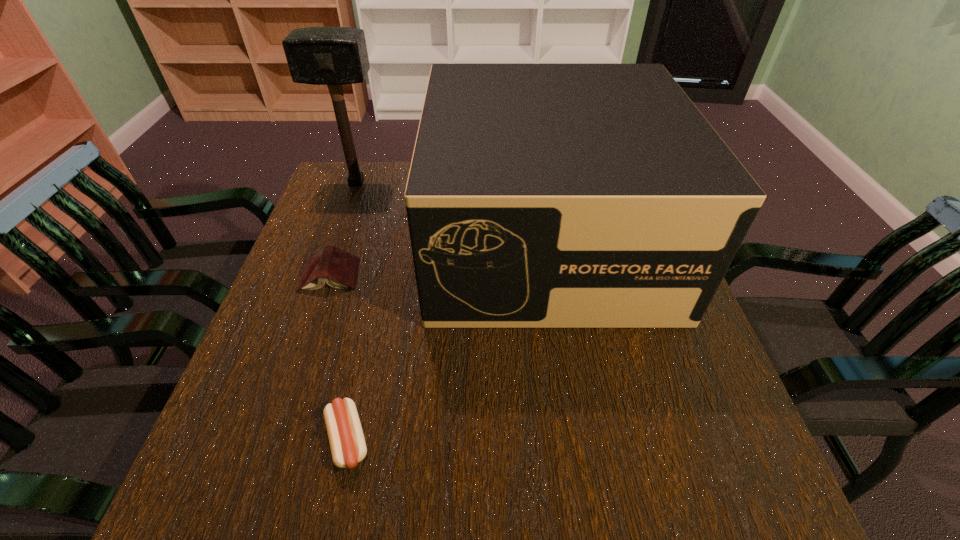
Where is `free spot at the right edge of the desktop`? free spot at the right edge of the desktop is located at coordinates (700, 396).

Locate an element on the screen. The width and height of the screenshot is (960, 540). vacant area that lies between the book and the tallest object is located at coordinates tap(344, 229).

Where is `empty space between the book and the mallet`? The image size is (960, 540). empty space between the book and the mallet is located at coordinates (344, 229).

Where is `free space between the sausage and the mallet`? Image resolution: width=960 pixels, height=540 pixels. free space between the sausage and the mallet is located at coordinates (352, 312).

Identify the location of empty space that is in between the nearest object and the book. The height and width of the screenshot is (540, 960). (339, 358).

Locate an element on the screen. free space between the sausage and the mallet is located at coordinates (352, 312).

You are a GUI agent. You are given a task and a screenshot of the screen. Output one action in this format:
    pyautogui.click(x=<x>, y=<y>)
    Task: Click on the free space between the mallet and the nearest object
    
    Given the screenshot: What is the action you would take?
    pyautogui.click(x=352, y=312)

I want to click on free point between the nearest object and the mallet, so click(x=352, y=312).

I want to click on vacant space that is in between the sausage and the rightmost object, so pyautogui.click(x=446, y=340).

The width and height of the screenshot is (960, 540). In order to click on free space between the second object from right to left and the second tallest object in this screenshot , I will do `click(446, 340)`.